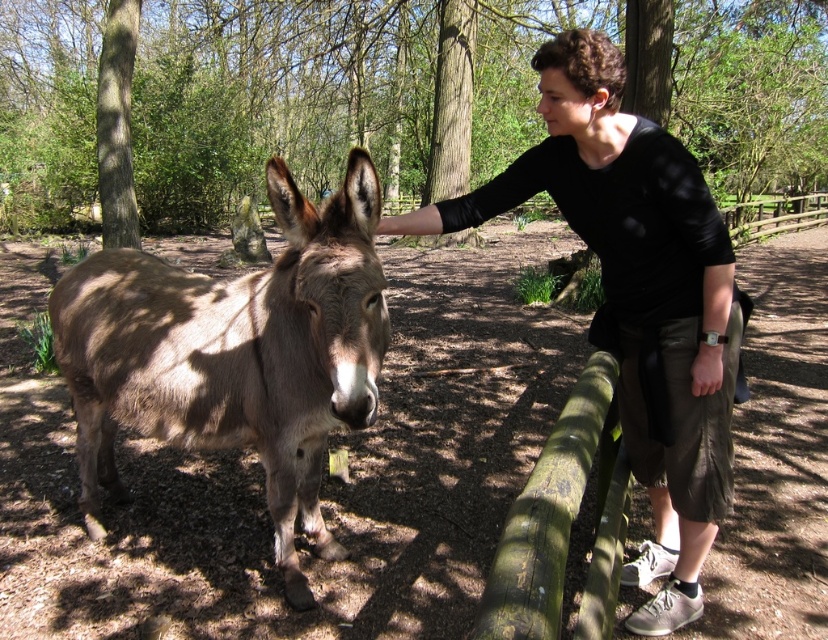
You are a photographer standing at the center of the park. You want to take a photo of the brown textured donkey at center and the black cotton shirt at upper right. If your camera has a maximum focus range of 4 feet, will both subjects be in focus?

The brown textured donkey at center and black cotton shirt at upper right are 3.96 feet apart. Since the distance between them is within the camera maximum focus range of 4 feet, both subjects will be in focus.

You are standing in the park and see the brown textured donkey at center. Where exactly is it located in the image?

The brown textured donkey at center is located at point (234, 355) in the image.

You are a photographer trying to capture a closeup of the brown textured donkey at center without the black cotton shirt at upper right appearing in the shot. Is this possible based on their positions?

Yes, the brown textured donkey at center is in front of the black cotton shirt at upper right, so you can focus on the donkey and exclude the shirt from the frame.